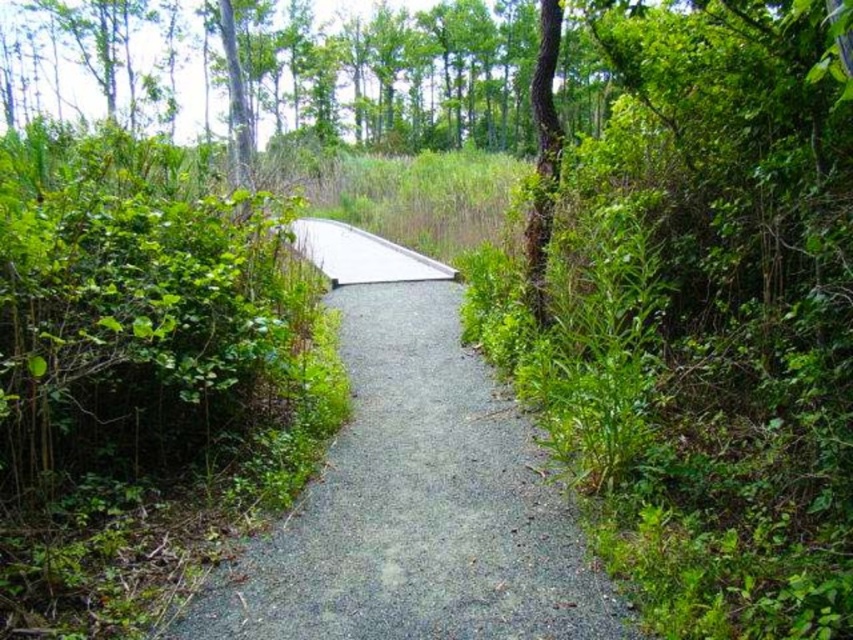
You are a hiker walking along the gravel path at center and notice a brown rough bark tree at right. Which object occupies a greater area in the scene?

The gravel path at center occupies a greater area than the brown rough bark tree at right according to the description.

You are a gardener standing on the gravel path at center and want to water the brown rough bark tree at right. Which direction should you move to reach the tree?

The gravel path at center is to the left of brown rough bark tree at right, so you should move to your right to reach the tree.

You are a hiker walking along the gravel path at center and notice a brown rough bark tree at right. Which object is closer to the ground?

The gravel path at center is positioned under the brown rough bark tree at right, meaning the gravel path at center is closer to the ground.